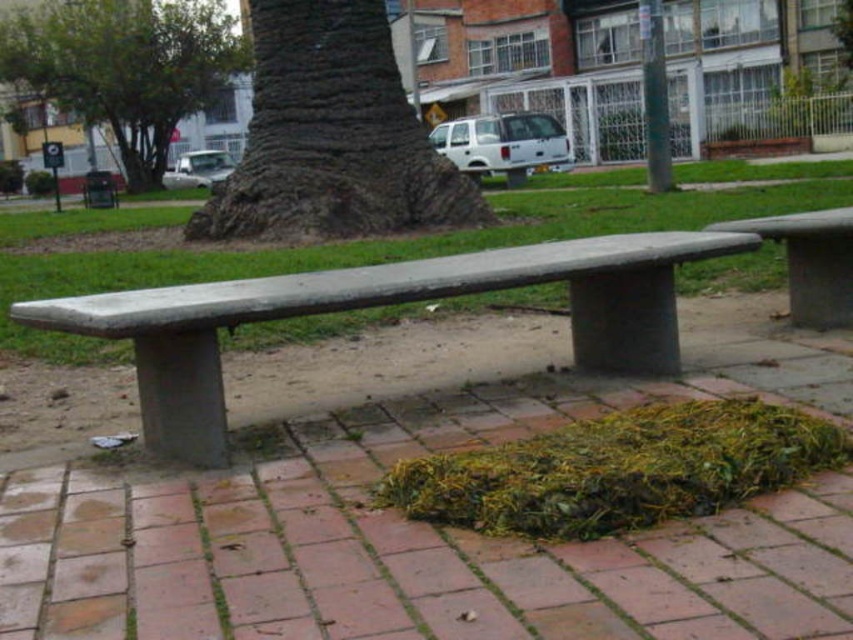
Consider the image. You are standing in the park and want to place a small potted plant between the two points, point (53, 634) and point (267, 289). Which point should the plant be closer to if you want it to be nearer to the residential buildings in the background?

The plant should be placed closer to point (267, 289) because it is farther from the viewer, meaning it is closer to the residential buildings in the background.

You are standing at the center of the park and see the smooth concrete bench at center. If you want to move directly towards the bench, which direction should you walk?

Since the smooth concrete bench at center is located at point [383,305], you should walk towards the center of the image where the bench is positioned.

You are a park visitor who wants to sit on the smooth concrete bench at center. You notice the brown rough bark at center nearby. Which object is closer to your current position if you are standing at the entrance of the park?

The smooth concrete bench at center is closer to your current position because it is to the right of the brown rough bark at center, meaning it is positioned further forward in the scene.